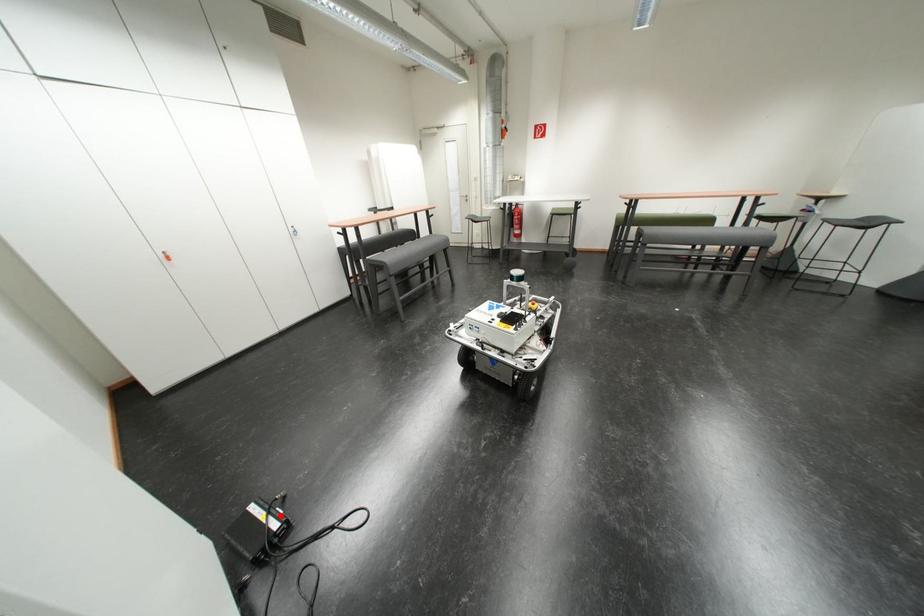
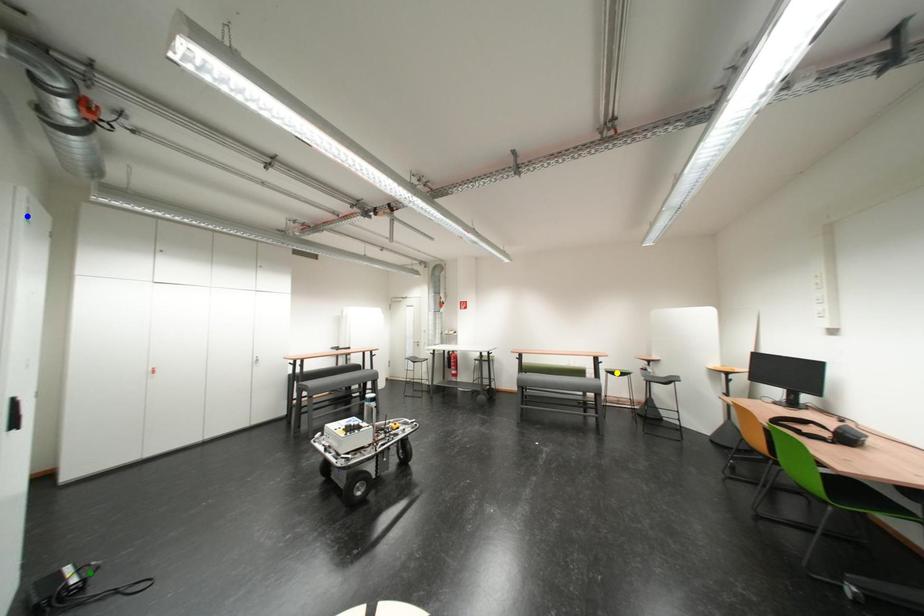
Question: I am providing you with two images of the same scene from different viewpoints. A red point is marked on the first image. You are given multiple points on the second image. Which point in image 2 represents the same 3d spot as the red point in image 1?

Choices:
 (A) blue point
 (B) yellow point
 (C) green point

Answer: (C)